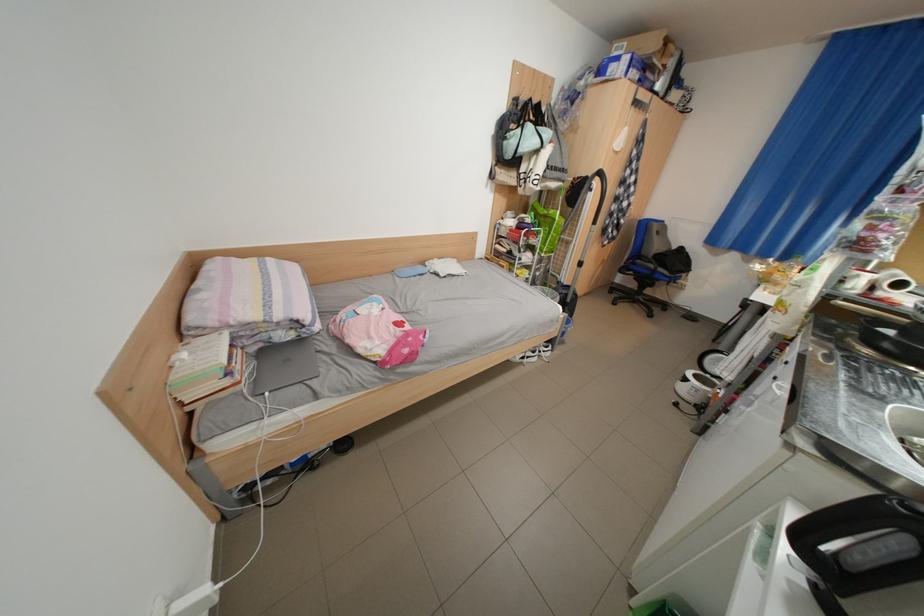
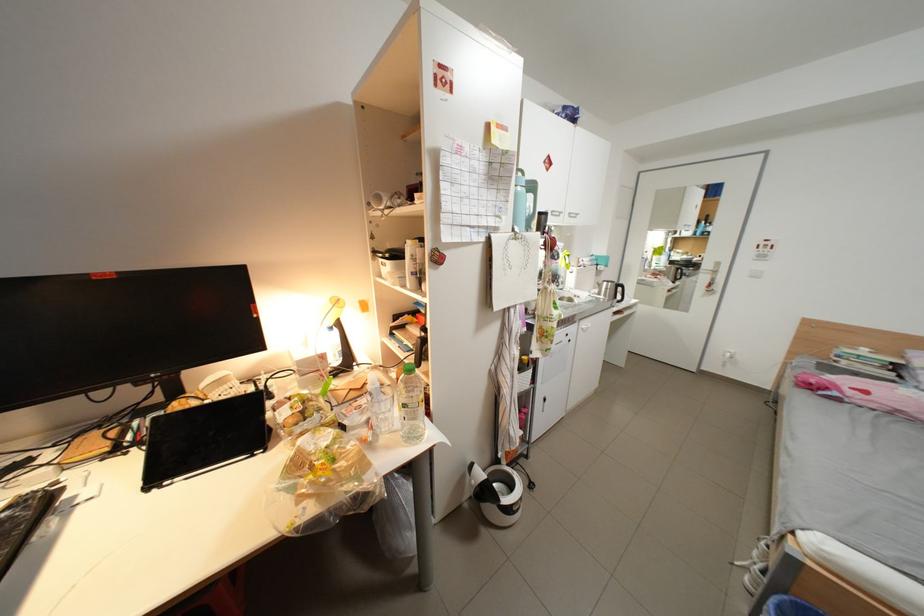
Question: I am providing you with two images of the same scene from different viewpoints. Which of the following objects are not visible in image2?

Choices:
 (A) silver door handle
 (B) white mug
 (C) black circular dial
 (D) white light switch

Answer: (B)